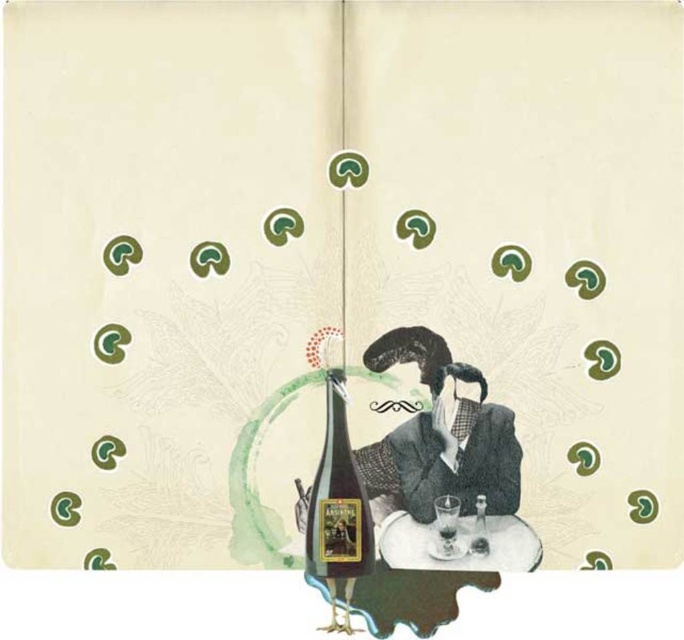
Does shiny dark green bottle at center have a greater height compared to translucent glass bottle at center?

Yes.

The width and height of the screenshot is (684, 640). What do you see at coordinates (337, 500) in the screenshot?
I see `shiny dark green bottle at center` at bounding box center [337, 500].

Is point (339, 516) closer to viewer compared to point (479, 518)?

No, it is not.

Find the location of a particular element. The image size is (684, 640). shiny dark green bottle at center is located at coordinates (337, 500).

Between transparent glass at center and translucent glass bottle at center, which one is positioned lower?

transparent glass at center

Is point (440, 538) in front of point (477, 538)?

No, (440, 538) is behind (477, 538).

The height and width of the screenshot is (640, 684). What are the coordinates of `transparent glass at center` in the screenshot? It's located at (447, 525).

Who is more distant from viewer, (475,540) or (453,531)?

Point (453,531)

Identify the location of translucent glass bottle at center. This screenshot has height=640, width=684. (479, 529).

Where is `translucent glass bottle at center`? The width and height of the screenshot is (684, 640). translucent glass bottle at center is located at coordinates (479, 529).